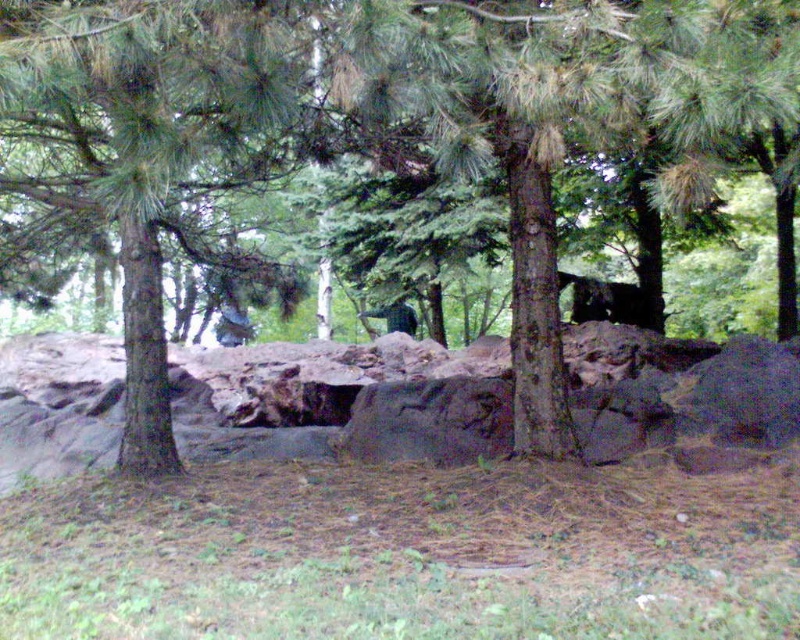
Question: Which object is farther from the camera taking this photo?

Choices:
 (A) brown rough tree at center
 (B) black furry bear at center
 (C) green matte bird at center

Answer: (C)

Question: Can you confirm if brown rough tree at center is bigger than green matte bird at center?

Choices:
 (A) yes
 (B) no

Answer: (A)

Question: Which of these objects is positioned farthest from the black furry bear at center?

Choices:
 (A) green matte bird at center
 (B) brown rough tree at center

Answer: (B)

Question: Does black furry bear at center appear over green matte bird at center?

Choices:
 (A) no
 (B) yes

Answer: (B)

Question: Based on their relative distances, which object is nearer to the brown rough tree at center?

Choices:
 (A) green matte bird at center
 (B) black furry bear at center

Answer: (B)

Question: Does brown rough tree at center appear on the left side of green matte bird at center?

Choices:
 (A) yes
 (B) no

Answer: (B)